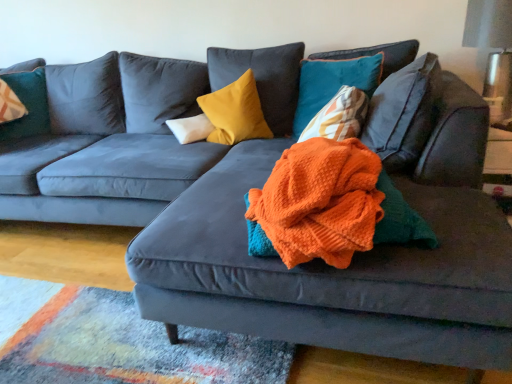
Question: Is the position of white soft pillow at center, which is counted as the 3th pillow, starting from the right, less distant than that of orange knitted blanket at center?

Choices:
 (A) no
 (B) yes

Answer: (A)

Question: Does white soft pillow at center, which is counted as the second pillow, starting from the left, turn towards orange knitted blanket at center?

Choices:
 (A) yes
 (B) no

Answer: (A)

Question: Can you confirm if white soft pillow at center, which is counted as the 3th pillow, starting from the right, is positioned to the left of orange knitted blanket at center?

Choices:
 (A) yes
 (B) no

Answer: (A)

Question: From a real-world perspective, is white soft pillow at center, which is counted as the 3th pillow, starting from the right, below orange knitted blanket at center?

Choices:
 (A) yes
 (B) no

Answer: (B)

Question: Does white soft pillow at center, which is counted as the 3th pillow, starting from the right, have a greater height compared to orange knitted blanket at center?

Choices:
 (A) yes
 (B) no

Answer: (A)

Question: Considering their positions, is velvet yellow pillow at center, the 3th pillow in the left-to-right sequence, located in front of or behind velvet teal pillow at upper left, placed as the 1th pillow when sorted from left to right?

Choices:
 (A) front
 (B) behind

Answer: (A)

Question: Visually, is velvet yellow pillow at center, the 3th pillow in the left-to-right sequence, positioned to the left or to the right of velvet teal pillow at upper left, placed as the 1th pillow when sorted from left to right?

Choices:
 (A) left
 (B) right

Answer: (B)

Question: From the image's perspective, is velvet yellow pillow at center, the 3th pillow in the left-to-right sequence, positioned above or below velvet teal pillow at upper left, which is the fourth pillow in right-to-left order?

Choices:
 (A) below
 (B) above

Answer: (A)

Question: Is point (222, 117) positioned closer to the camera than point (30, 61)?

Choices:
 (A) closer
 (B) farther

Answer: (A)

Question: Considering their positions, is white soft pillow at center, which is counted as the second pillow, starting from the left, located in front of or behind velvet teal pillow at upper left, which is the fourth pillow in right-to-left order?

Choices:
 (A) behind
 (B) front

Answer: (B)

Question: Considering the positions of white soft pillow at center, which is counted as the 3th pillow, starting from the right, and velvet teal pillow at upper left, which is the fourth pillow in right-to-left order, in the image, is white soft pillow at center, which is counted as the 3th pillow, starting from the right, taller or shorter than velvet teal pillow at upper left, which is the fourth pillow in right-to-left order,?

Choices:
 (A) short
 (B) tall

Answer: (A)

Question: Is point (203, 115) closer or farther from the camera than point (30, 89)?

Choices:
 (A) closer
 (B) farther

Answer: (A)

Question: Is white soft pillow at center, which is counted as the 3th pillow, starting from the right, to the left or to the right of velvet teal pillow at upper left, placed as the 1th pillow when sorted from left to right, in the image?

Choices:
 (A) right
 (B) left

Answer: (A)

Question: Is white soft pillow at center, which is counted as the 3th pillow, starting from the right, inside the boundaries of teal velvet pillow at upper right, positioned as the 4th pillow in left-to-right order, or outside?

Choices:
 (A) outside
 (B) inside

Answer: (A)

Question: From the image's perspective, relative to teal velvet pillow at upper right, positioned as the 4th pillow in left-to-right order, is white soft pillow at center, which is counted as the 3th pillow, starting from the right, above or below?

Choices:
 (A) below
 (B) above

Answer: (A)